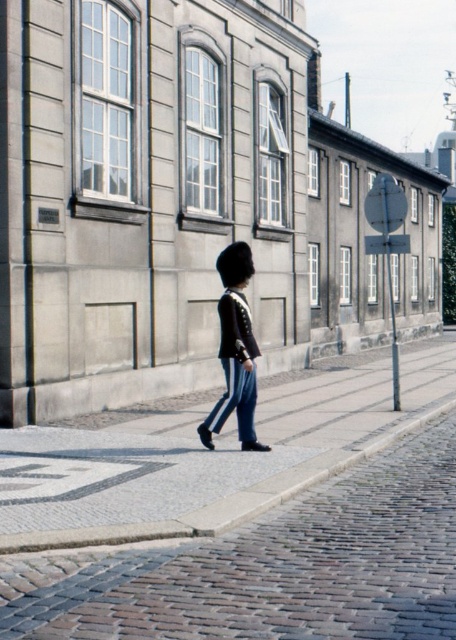
You are a delivery person trying to place a package on the cobblestone pavement at center. The package requires a flat surface that is at least as tall as the shiny black uniform at center. Based on the scene, can you place the package there?

The cobblestone pavement at center is not as tall as the shiny black uniform at center, so the package cannot be placed there as it does not meet the height requirement.

You are a photographer trying to capture the shiny black uniform at center and the cobblestone pavement at center in a single shot. Which object should you focus on first if you want to ensure both are in frame?

The cobblestone pavement at center is positioned on the left side of the shiny black uniform at center. To capture both in a single shot, focus on the shiny black uniform at center first as it is the main subject, then adjust the frame to include the cobblestone pavement at center on its left.